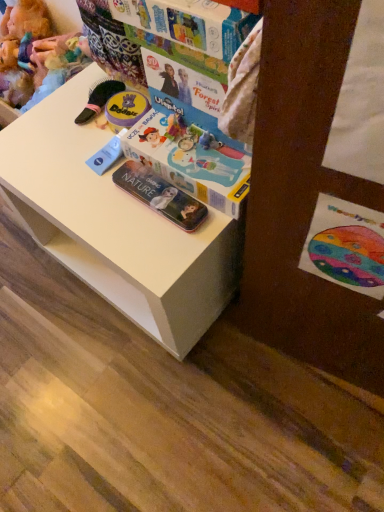
Question: From the image's perspective, is fuzzy fabric doll at upper left above or below watercolor paper postcard at lower right?

Choices:
 (A) below
 (B) above

Answer: (B)

Question: From a real-world perspective, is fuzzy fabric doll at upper left positioned above or below watercolor paper postcard at lower right?

Choices:
 (A) below
 (B) above

Answer: (A)

Question: Which is nearer to the white plastic changing table at center?

Choices:
 (A) transparent plastic case at lower center
 (B) multicolored cardboard book at upper center
 (C) fuzzy fabric doll at upper left
 (D) watercolor paper postcard at lower right

Answer: (A)

Question: Estimate the real-world distances between objects in this image. Which object is closer to the watercolor paper postcard at lower right?

Choices:
 (A) white plastic changing table at center
 (B) transparent plastic case at lower center
 (C) fuzzy fabric doll at upper left
 (D) multicolored cardboard book at upper center

Answer: (B)